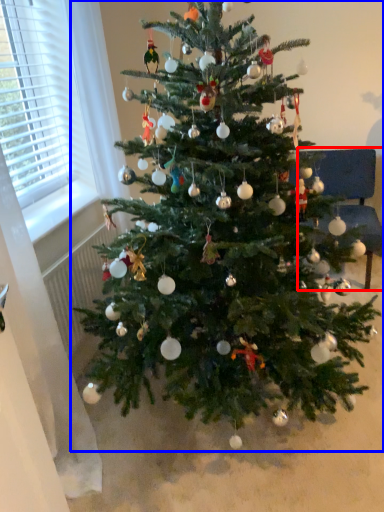
Question: Which object is closer to the camera taking this photo, armchair (highlighted by a red box) or christmas tree (highlighted by a blue box)?

Choices:
 (A) armchair
 (B) christmas tree

Answer: (B)